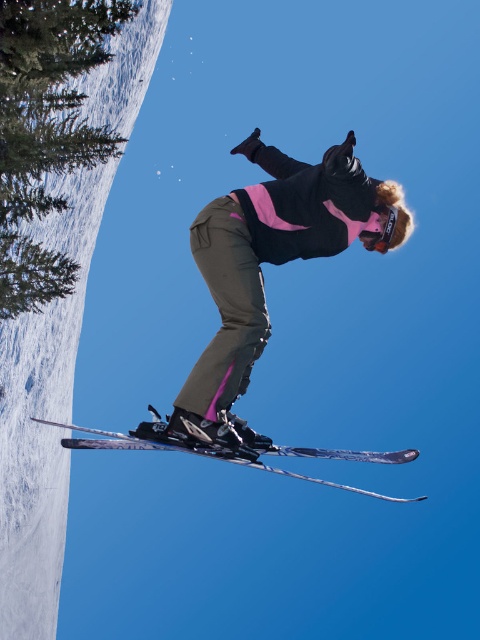
Is matte black ski suit at center thinner than shiny metallic skis at center?

In fact, matte black ski suit at center might be wider than shiny metallic skis at center.

Can you confirm if matte black ski suit at center is taller than shiny metallic skis at center?

Indeed, matte black ski suit at center has a greater height compared to shiny metallic skis at center.

The image size is (480, 640). What do you see at coordinates (273, 260) in the screenshot? I see `matte black ski suit at center` at bounding box center [273, 260].

Find the location of `matte black ski suit at center`. matte black ski suit at center is located at coordinates (273, 260).